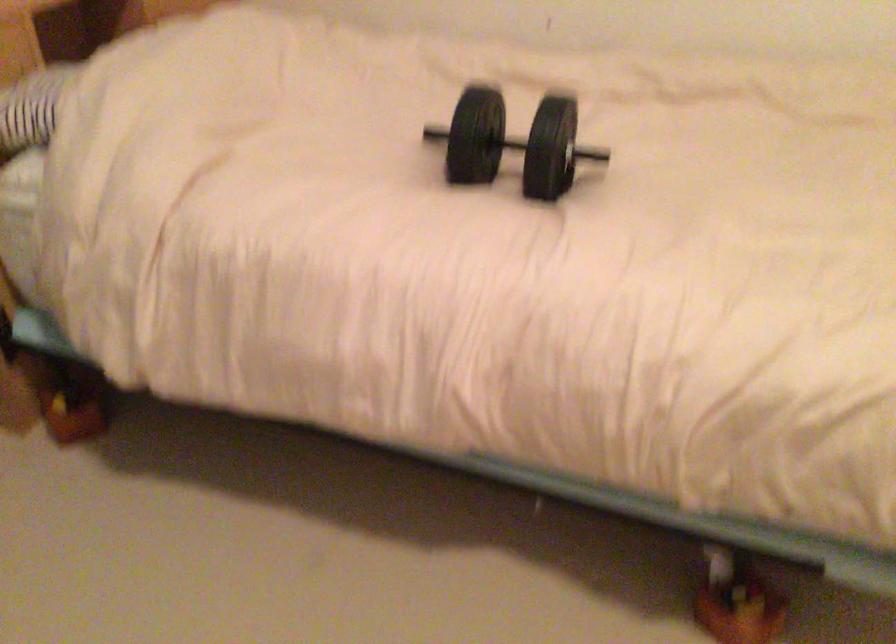
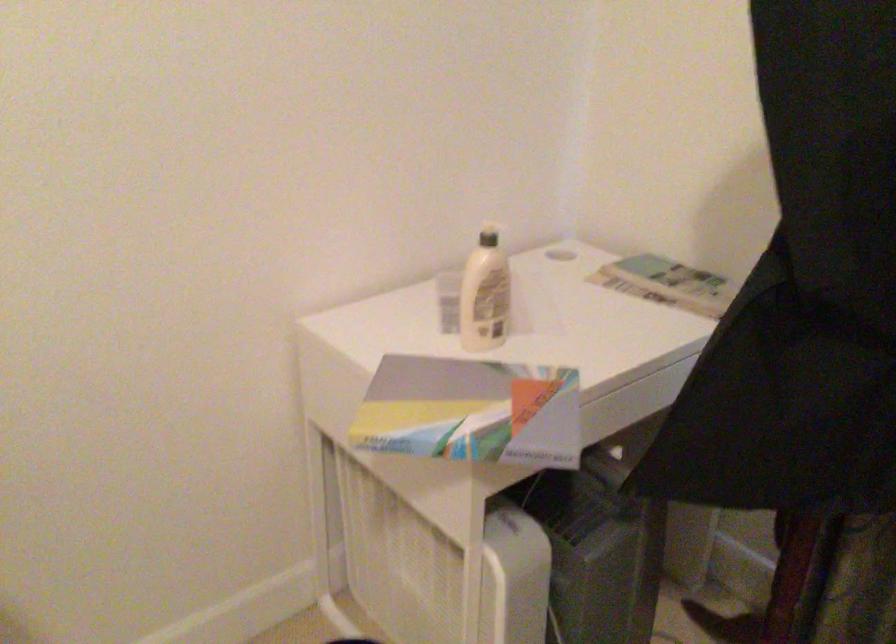
How did the camera likely rotate?

The camera's rotation is toward left-down.